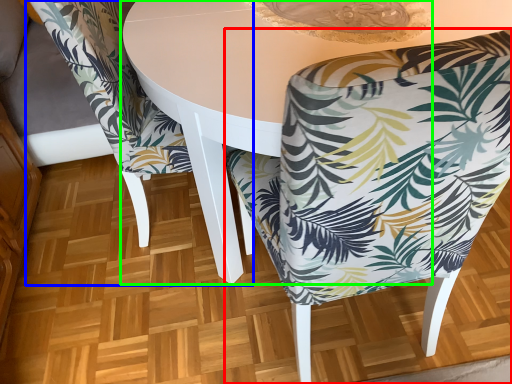
Question: Considering the real-world distances, which object is closest to chair (highlighted by a red box)? chair (highlighted by a blue box) or round table (highlighted by a green box).

Choices:
 (A) chair
 (B) round table

Answer: (B)